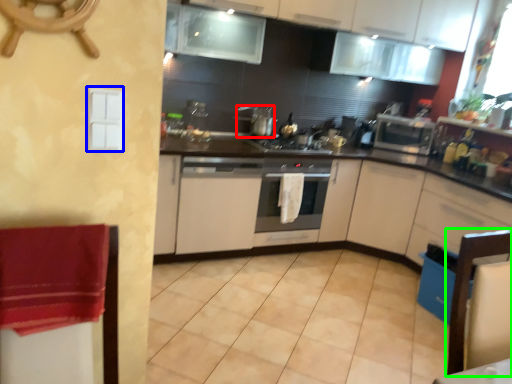
Question: Considering the real-world distances, which object is farthest from kitchen appliance (highlighted by a red box)? light switch (highlighted by a blue box) or chair (highlighted by a green box)?

Choices:
 (A) light switch
 (B) chair

Answer: (A)